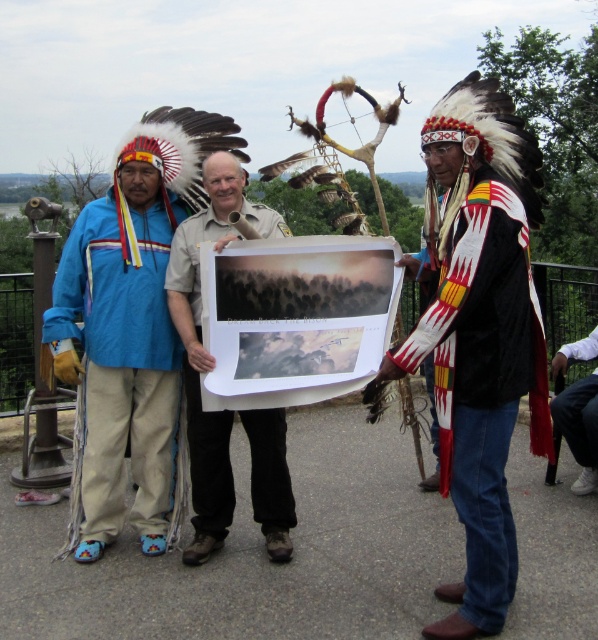
Who is higher up, blue fabric jacket at left or white cotton shirt at lower right?

blue fabric jacket at left

Which of these two, blue fabric jacket at left or white cotton shirt at lower right, stands shorter?

Standing shorter between the two is white cotton shirt at lower right.

Between point (102, 518) and point (548, 472), which one is positioned in front?

Point (102, 518)

At what (x,y) coordinates should I click in order to perform the action: click on blue fabric jacket at left. Please return your answer as a coordinate pair (x, y). Image resolution: width=598 pixels, height=640 pixels. Looking at the image, I should click on (120, 364).

From the picture: Is the position of velvet black jacket at right less distant than that of white cotton shirt at lower right?

Yes, velvet black jacket at right is closer to the viewer.

Does velvet black jacket at right have a lesser width compared to white cotton shirt at lower right?

No.

Who is more distant from viewer, [478,273] or [570,435]?

Positioned behind is point [570,435].

What are the coordinates of `velvet black jacket at right` in the screenshot? It's located at (483, 388).

Is point (471, 240) closer to viewer compared to point (160, 445)?

Yes, point (471, 240) is closer to viewer.

Which is more to the left, velvet black jacket at right or blue fabric jacket at left?

blue fabric jacket at left

This screenshot has width=598, height=640. Find the location of `velvet black jacket at right`. velvet black jacket at right is located at coordinates (483, 388).